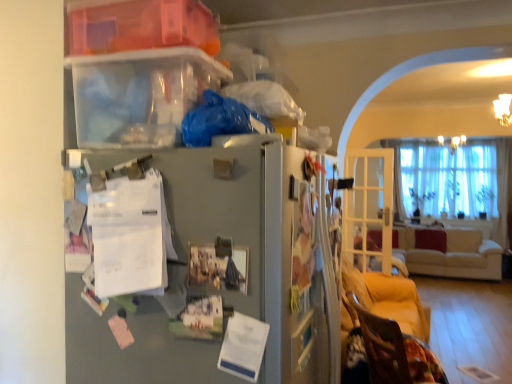
Question: From the image's perspective, does beige fabric couch at right appear higher than clear glass door at right?

Choices:
 (A) no
 (B) yes

Answer: (A)

Question: From a real-world perspective, is beige fabric couch at right located higher than clear glass door at right?

Choices:
 (A) no
 (B) yes

Answer: (A)

Question: Is beige fabric couch at right in contact with clear glass door at right?

Choices:
 (A) no
 (B) yes

Answer: (A)

Question: Would you say beige fabric couch at right is outside clear glass door at right?

Choices:
 (A) yes
 (B) no

Answer: (A)

Question: Is beige fabric couch at right smaller than clear glass door at right?

Choices:
 (A) yes
 (B) no

Answer: (B)

Question: Considering the positions of beige fabric couch at right and translucent plastic storage box at upper left in the image, is beige fabric couch at right wider or thinner than translucent plastic storage box at upper left?

Choices:
 (A) thin
 (B) wide

Answer: (B)

Question: Is beige fabric couch at right inside the boundaries of translucent plastic storage box at upper left, or outside?

Choices:
 (A) inside
 (B) outside

Answer: (B)

Question: Does point (x=420, y=266) appear closer or farther from the camera than point (x=193, y=14)?

Choices:
 (A) farther
 (B) closer

Answer: (A)

Question: Based on their positions, is beige fabric couch at right located to the left or right of translucent plastic storage box at upper left?

Choices:
 (A) left
 (B) right

Answer: (B)

Question: From a real-world perspective, is metallic gray fridge at center physically located above or below velvet brown armchair at lower right?

Choices:
 (A) above
 (B) below

Answer: (A)

Question: Visually, is metallic gray fridge at center positioned to the left or to the right of velvet brown armchair at lower right?

Choices:
 (A) right
 (B) left

Answer: (B)

Question: Relative to velvet brown armchair at lower right, is metallic gray fridge at center in front or behind?

Choices:
 (A) behind
 (B) front

Answer: (B)

Question: Choose the correct answer: Is metallic gray fridge at center inside velvet brown armchair at lower right or outside it?

Choices:
 (A) inside
 (B) outside

Answer: (B)

Question: From their relative heights in the image, would you say metallic gray fridge at center is taller or shorter than beige fabric couch at right?

Choices:
 (A) short
 (B) tall

Answer: (B)

Question: Is metallic gray fridge at center to the left or to the right of beige fabric couch at right in the image?

Choices:
 (A) left
 (B) right

Answer: (A)